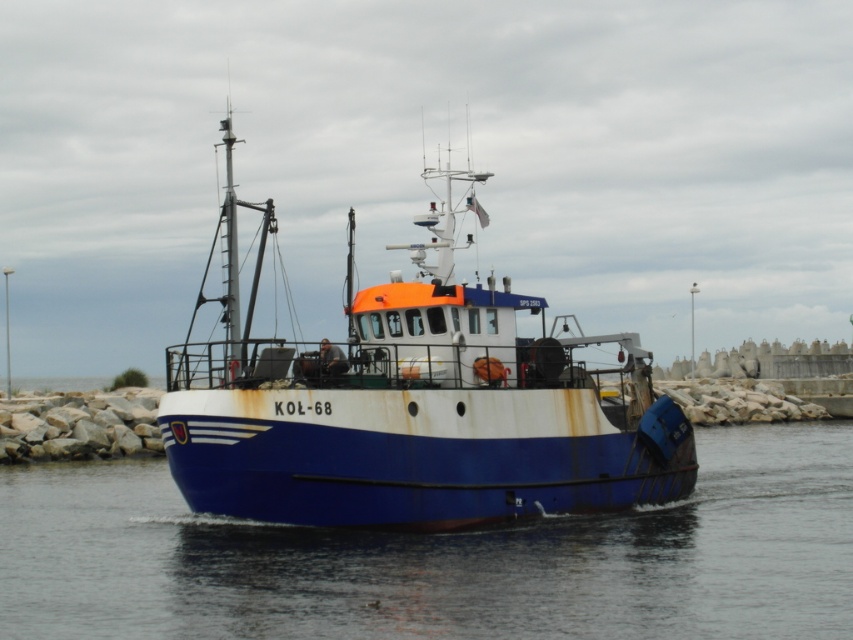
You are a marine biologist observing the fishing boat KOL 68. You need to determine if the blue smooth water at center is wide enough to allow the rusty metal boat at center to turn around without touching either side. Can you confirm this?

The blue smooth water at center is wider than the rusty metal boat at center, so yes, the boat can turn around without touching either side.

You are standing on the deck of the fishing boat KOL 68 and looking at the scene. There is a point marked at coordinate [442,557]. What is located at this point?

The point at coordinate [442,557] marks blue smooth water at center.